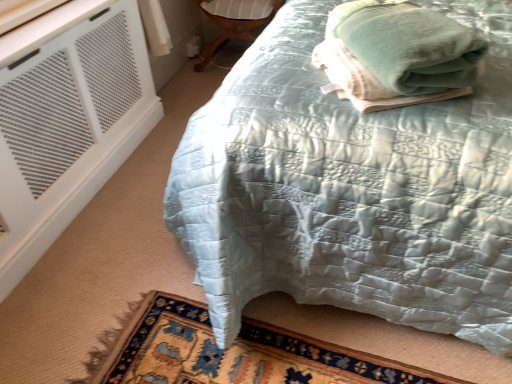
Describe the element at coordinates (351, 189) in the screenshot. I see `silky blue quilt at center` at that location.

Describe the element at coordinates (397, 54) in the screenshot. The width and height of the screenshot is (512, 384). I see `green soft towel at upper right` at that location.

Find the location of a particular element. white mesh air conditioning at lower left is located at coordinates (68, 113).

Who is shorter, matte wood side table at lower center or green soft towel at upper right?

green soft towel at upper right is shorter.

Can you tell me how much matte wood side table at lower center and green soft towel at upper right differ in facing direction?

The angle between the facing direction of matte wood side table at lower center and the facing direction of green soft towel at upper right is 29.9 degrees.

Does matte wood side table at lower center have a lesser width compared to green soft towel at upper right?

No.

Is white mesh air conditioning at lower left looking in the opposite direction of matte wood side table at lower center?

No.

Which of these two, white mesh air conditioning at lower left or matte wood side table at lower center, is bigger?

Bigger between the two is white mesh air conditioning at lower left.

Considering the sizes of objects white mesh air conditioning at lower left and matte wood side table at lower center in the image provided, who is taller, white mesh air conditioning at lower left or matte wood side table at lower center?

white mesh air conditioning at lower left is taller.

How many degrees apart are the facing directions of carpeted rug at lower left and silky blue quilt at center?

carpeted rug at lower left and silky blue quilt at center are facing 3.24 degrees away from each other.

Would you say carpeted rug at lower left is outside silky blue quilt at center?

Actually, carpeted rug at lower left is within silky blue quilt at center.

Is carpeted rug at lower left aimed at silky blue quilt at center?

Yes, carpeted rug at lower left is facing silky blue quilt at center.

Which is in front, point (183, 341) or point (454, 271)?

The point (454, 271) is closer.

Can you confirm if white mesh air conditioning at lower left is thinner than carpeted rug at lower left?

Correct, the width of white mesh air conditioning at lower left is less than that of carpeted rug at lower left.

Is point (17, 239) positioned after point (251, 358)?

Yes, it is.

Is white mesh air conditioning at lower left behind carpeted rug at lower left?

That is True.

From a real-world perspective, is green soft towel at upper right positioned over matte wood side table at lower center based on gravity?

Yes, from a real-world perspective, green soft towel at upper right is above matte wood side table at lower center.

Which object is positioned more to the left, green soft towel at upper right or matte wood side table at lower center?

Positioned to the left is matte wood side table at lower center.

Is matte wood side table at lower center located within green soft towel at upper right?

No, green soft towel at upper right does not contain matte wood side table at lower center.

What's the angular difference between green soft towel at upper right and matte wood side table at lower center's facing directions?

There is a 29.9-degree angle between the facing directions of green soft towel at upper right and matte wood side table at lower center.

From a real-world perspective, is green soft towel at upper right below white mesh air conditioning at lower left?

Actually, green soft towel at upper right is physically above white mesh air conditioning at lower left in the real world.

Does green soft towel at upper right touch white mesh air conditioning at lower left?

No, green soft towel at upper right is not beside white mesh air conditioning at lower left.

Identify the location of bath towel that is on the right side of white mesh air conditioning at lower left. click(x=397, y=54).

Could you tell me if green soft towel at upper right is facing white mesh air conditioning at lower left?

No, green soft towel at upper right is not turned towards white mesh air conditioning at lower left.

Based on the photo, from a real-world perspective, between carpeted rug at lower left and green soft towel at upper right, who is vertically lower?

From a 3D spatial view, carpeted rug at lower left is below.

Are carpeted rug at lower left and green soft towel at upper right located far from each other?

No.

Identify the location of furniture that appears above the green soft towel at upper right (from the image's perspective). tap(236, 21).

The height and width of the screenshot is (384, 512). Identify the location of air conditioning on the left of the matte wood side table at lower center. (68, 113).

Which object lies nearer to the anchor point matte wood side table at lower center, carpeted rug at lower left or white mesh air conditioning at lower left?

Among the two, white mesh air conditioning at lower left is located nearer to matte wood side table at lower center.

Considering their positions, is carpeted rug at lower left positioned further to matte wood side table at lower center than silky blue quilt at center?

carpeted rug at lower left is positioned further to the anchor matte wood side table at lower center.

From the image, which object appears to be nearer to carpeted rug at lower left, silky blue quilt at center or matte wood side table at lower center?

silky blue quilt at center lies closer to carpeted rug at lower left than the other object.

Looking at this image, estimate the real-world distances between objects in this image. Which object is further from matte wood side table at lower center, green soft towel at upper right or carpeted rug at lower left?

carpeted rug at lower left is positioned further to the anchor matte wood side table at lower center.

Which object lies nearer to the anchor point green soft towel at upper right, white mesh air conditioning at lower left or carpeted rug at lower left?

The object closer to green soft towel at upper right is carpeted rug at lower left.

Which object lies nearer to the anchor point white mesh air conditioning at lower left, green soft towel at upper right or matte wood side table at lower center?

matte wood side table at lower center is positioned closer to the anchor white mesh air conditioning at lower left.

Considering their positions, is matte wood side table at lower center positioned further to white mesh air conditioning at lower left than carpeted rug at lower left?

matte wood side table at lower center lies further to white mesh air conditioning at lower left than the other object.

In the scene shown: When comparing their distances from matte wood side table at lower center, does silky blue quilt at center or white mesh air conditioning at lower left seem further?

silky blue quilt at center is positioned further to the anchor matte wood side table at lower center.

Where is `bath towel between white mesh air conditioning at lower left and silky blue quilt at center from left to right`? bath towel between white mesh air conditioning at lower left and silky blue quilt at center from left to right is located at coordinates (397, 54).

Find the location of `bath towel between silky blue quilt at center and matte wood side table at lower center along the z-axis`. bath towel between silky blue quilt at center and matte wood side table at lower center along the z-axis is located at coordinates (397, 54).

Where is `mat between green soft towel at upper right and matte wood side table at lower center along the z-axis`? This screenshot has width=512, height=384. mat between green soft towel at upper right and matte wood side table at lower center along the z-axis is located at coordinates (238, 353).

You are a GUI agent. You are given a task and a screenshot of the screen. Output one action in this format:
    pyautogui.click(x=<x>, y=<y>)
    Task: Click on the air conditioning positioned between silky blue quilt at center and matte wood side table at lower center from near to far
    
    Given the screenshot: What is the action you would take?
    pyautogui.click(x=68, y=113)